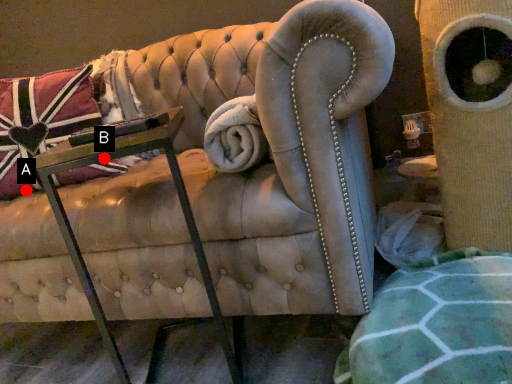
Question: Two points are circled on the image, labeled by A and B beside each circle. Which point appears closest to the camera in this image?

Choices:
 (A) A is closer
 (B) B is closer

Answer: (B)